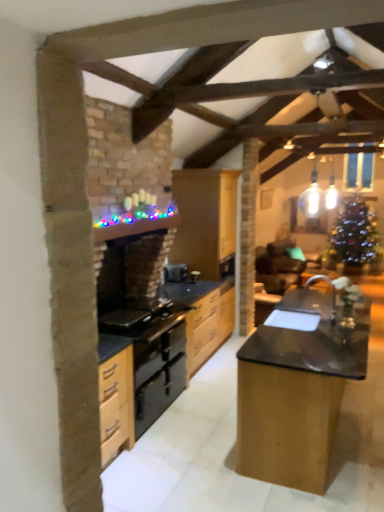
Question: Is teal fabric armchair at center positioned beyond the bounds of black polished wood table at center?

Choices:
 (A) no
 (B) yes

Answer: (B)

Question: Is teal fabric armchair at center at the right side of black polished wood table at center?

Choices:
 (A) no
 (B) yes

Answer: (B)

Question: Is teal fabric armchair at center thinner than black polished wood table at center?

Choices:
 (A) yes
 (B) no

Answer: (B)

Question: From a real-world perspective, is teal fabric armchair at center physically above black polished wood table at center?

Choices:
 (A) no
 (B) yes

Answer: (A)

Question: Considering the relative sizes of teal fabric armchair at center and black polished wood table at center in the image provided, is teal fabric armchair at center smaller than black polished wood table at center?

Choices:
 (A) no
 (B) yes

Answer: (B)

Question: Is black polished wood table at center spatially inside black granite sink at center, or outside of it?

Choices:
 (A) inside
 (B) outside

Answer: (B)

Question: Considering the positions of black polished wood table at center and black granite sink at center in the image, is black polished wood table at center wider or thinner than black granite sink at center?

Choices:
 (A) wide
 (B) thin

Answer: (A)

Question: Is point (246, 367) positioned closer to the camera than point (316, 312)?

Choices:
 (A) closer
 (B) farther

Answer: (A)

Question: Is black polished wood table at center to the left or to the right of black granite sink at center in the image?

Choices:
 (A) left
 (B) right

Answer: (B)

Question: Based on their positions, is black polished wood table at center located to the left or right of wooden cabinets at center?

Choices:
 (A) left
 (B) right

Answer: (B)

Question: In the image, is black polished wood table at center positioned in front of or behind wooden cabinets at center?

Choices:
 (A) behind
 (B) front

Answer: (B)

Question: From the image's perspective, is black polished wood table at center located above or below wooden cabinets at center?

Choices:
 (A) above
 (B) below

Answer: (B)

Question: From a real-world perspective, is black polished wood table at center physically located above or below wooden cabinets at center?

Choices:
 (A) above
 (B) below

Answer: (B)

Question: Is black matte oven at center in front of or behind black granite countertop at center in the image?

Choices:
 (A) front
 (B) behind

Answer: (B)

Question: Is black matte oven at center wider or thinner than black granite countertop at center?

Choices:
 (A) wide
 (B) thin

Answer: (B)